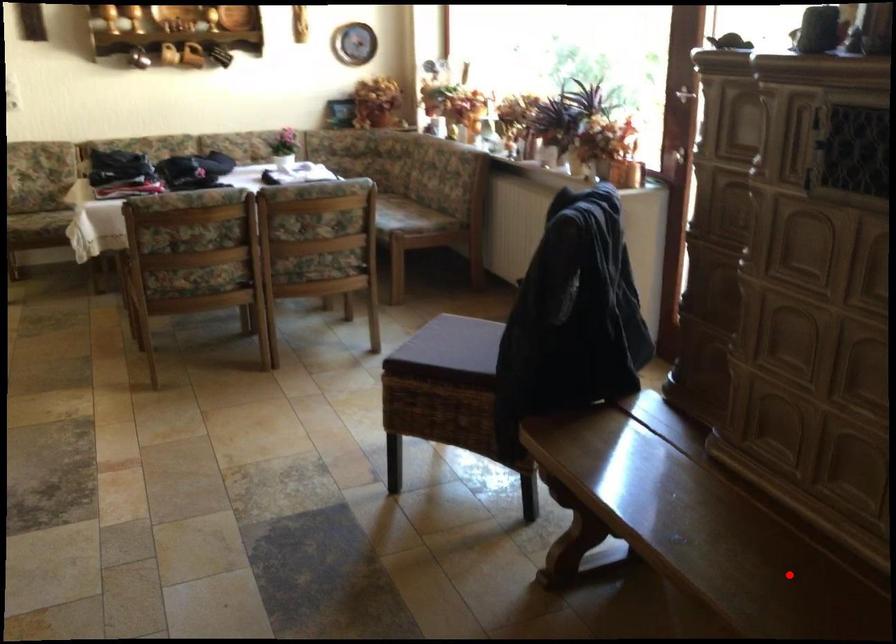
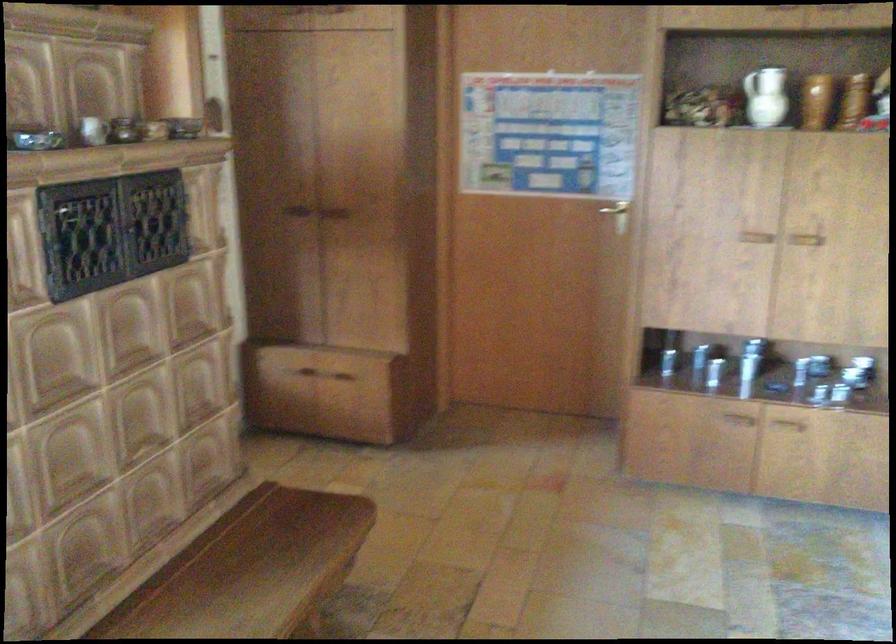
Find the pixel in the second image that matches the highlighted location in the first image.

(252, 570)